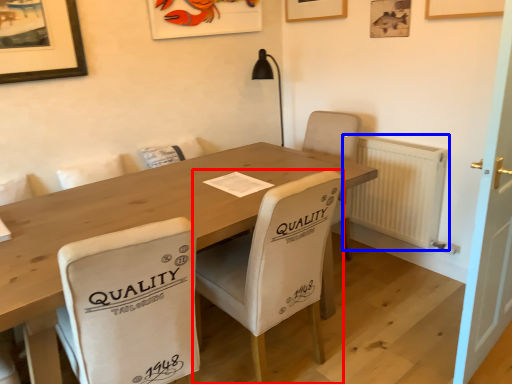
Question: Which of the following is the farthest to the observer, chair (highlighted by a red box) or radiator (highlighted by a blue box)?

Choices:
 (A) chair
 (B) radiator

Answer: (B)